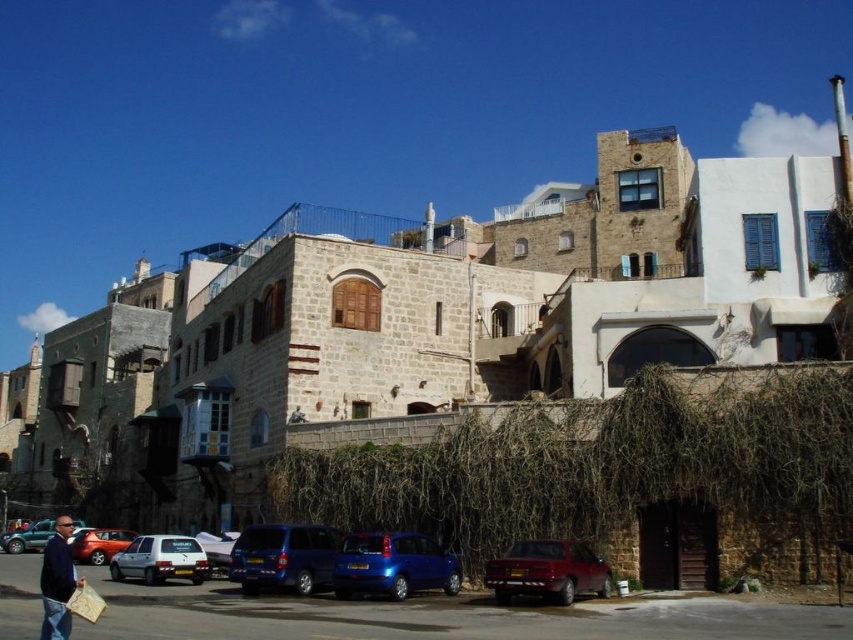
Can you confirm if brown straw at center is positioned above matte blue car at lower left?

Yes, brown straw at center is above matte blue car at lower left.

Does point (473, 424) come closer to viewer compared to point (74, 525)?

Yes, it is in front of point (74, 525).

Does point (587, 492) come in front of point (4, 536)?

That is True.

The height and width of the screenshot is (640, 853). Identify the location of brown straw at center. (596, 464).

Does point (189, 561) come in front of point (207, 538)?

Yes.

Can you confirm if white matte car at lower left is positioned to the right of metallic silver car at center?

Incorrect, white matte car at lower left is not on the right side of metallic silver car at center.

The height and width of the screenshot is (640, 853). I want to click on white matte car at lower left, so click(160, 560).

Does point (248, 525) come closer to viewer compared to point (103, 534)?

Yes, point (248, 525) is in front of point (103, 534).

Does metallic blue suv at center have a larger size compared to matte red car at lower left?

No.

Does point (235, 563) lie behind point (82, 531)?

No, it is not.

Locate an element on the screen. metallic blue suv at center is located at coordinates (283, 557).